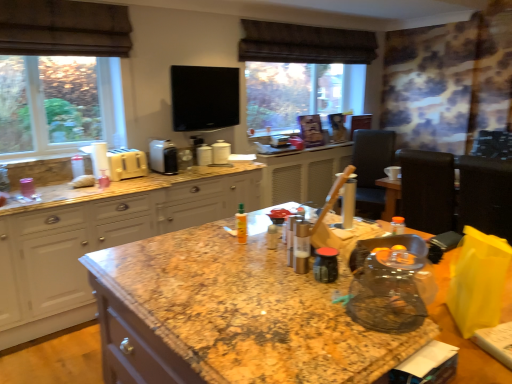
The image size is (512, 384). Describe the element at coordinates (83, 181) in the screenshot. I see `bread dough at left` at that location.

At what (x,y) coordinates should I click in order to perform the action: click on bread dough at left. Please return your answer as a coordinate pair (x, y). This screenshot has height=384, width=512. Looking at the image, I should click on (83, 181).

Measure the distance between point (109,152) and camera.

The depth of point (109,152) is 3.14 meters.

The width and height of the screenshot is (512, 384). Describe the element at coordinates (302, 174) in the screenshot. I see `granite countertop at center` at that location.

What do you see at coordinates (101, 241) in the screenshot? The height and width of the screenshot is (384, 512). I see `matte granite countertop at left` at bounding box center [101, 241].

The width and height of the screenshot is (512, 384). What do you see at coordinates (241, 224) in the screenshot?
I see `yellow matte bottle at center` at bounding box center [241, 224].

Measure the distance between point (435, 215) and camera.

Point (435, 215) and camera are 10.72 feet apart.

What are the coordinates of `bread dough at left` in the screenshot? It's located at (83, 181).

Is yellow plastic toaster at left, which is the 4th appliance in right-to-left order, to the left of white glossy canister at center, arranged as the 1th appliance when viewed from the right, from the viewer's perspective?

Indeed, yellow plastic toaster at left, which is the 4th appliance in right-to-left order, is positioned on the left side of white glossy canister at center, arranged as the 1th appliance when viewed from the right.

Is yellow plastic toaster at left, the first appliance viewed from the left, facing towards white glossy canister at center, arranged as the 1th appliance when viewed from the right?

No, yellow plastic toaster at left, the first appliance viewed from the left, is not oriented towards white glossy canister at center, arranged as the 1th appliance when viewed from the right.

Looking at their sizes, would you say yellow plastic toaster at left, which is the 4th appliance in right-to-left order, is wider or thinner than white glossy canister at center, marked as the 4th appliance in a left-to-right arrangement?

yellow plastic toaster at left, which is the 4th appliance in right-to-left order, is wider than white glossy canister at center, marked as the 4th appliance in a left-to-right arrangement.

Which is nearer, (x=77, y=179) or (x=220, y=272)?

Point (x=77, y=179) appears to be farther away from the viewer than point (x=220, y=272).

Are bread dough at left and granite at center far apart?

Indeed, bread dough at left is not near granite at center.

Does bread dough at left appear on the right side of granite at center?

In fact, bread dough at left is to the left of granite at center.

Does white glossy canisters at center, arranged as the 3th appliance when viewed from the left, have a smaller size compared to white plastic toaster at center, marked as the 2th appliance in a left-to-right arrangement?

Yes.

In the scene shown: Does white glossy canisters at center, arranged as the 3th appliance when viewed from the left, come behind white plastic toaster at center, which is the 3th appliance from right to left?

Yes, the depth of white glossy canisters at center, arranged as the 3th appliance when viewed from the left, is greater than that of white plastic toaster at center, which is the 3th appliance from right to left.

From a real-world perspective, is white glossy canisters at center, the second appliance from the right, under white plastic toaster at center, which is the 3th appliance from right to left?

Yes, from a real-world perspective, white glossy canisters at center, the second appliance from the right, is below white plastic toaster at center, which is the 3th appliance from right to left.

Find the location of a particular element. the 1st appliance above the white plastic toaster at center, which is the 3th appliance from right to left (from the image's perspective) is located at coordinates (204, 155).

Which object is more forward, matte granite countertop at left or granite countertop at center?

matte granite countertop at left is closer to the camera.

From the image's perspective, relative to granite countertop at center, is matte granite countertop at left above or below?

Based on their image positions, matte granite countertop at left is located beneath granite countertop at center.

Which of these two, matte granite countertop at left or granite countertop at center, is bigger?

matte granite countertop at left.

Measure the distance between matte granite countertop at left and granite countertop at center.

They are 4.32 feet apart.

Is bread dough at left looking in the opposite direction of dark brown leather chair at right, which is the 2th chair from front to back?

bread dough at left is not turned away from dark brown leather chair at right, which is the 2th chair from front to back.

Which chair is the 1st one when counting from the right side of the bread dough at left? Please provide its 2D coordinates.

[(371, 168)]

How different are the orientations of bread dough at left and dark brown leather chair at right, which is the 2th chair from front to back, in degrees?

The angular difference between bread dough at left and dark brown leather chair at right, which is the 2th chair from front to back, is 66.2 degrees.

Considering the points (90, 181) and (368, 176), which point is in front, point (90, 181) or point (368, 176)?

The point (90, 181) is more forward.

Which object is closer to the camera, dark brown leather chair at right, placed as the 1th chair when sorted from back to front, or white glossy canister at center, marked as the 4th appliance in a left-to-right arrangement?

white glossy canister at center, marked as the 4th appliance in a left-to-right arrangement, is more forward.

Is dark brown leather chair at right, which is the 2th chair from front to back, located outside white glossy canister at center, arranged as the 1th appliance when viewed from the right?

Yes, dark brown leather chair at right, which is the 2th chair from front to back, is located beyond the bounds of white glossy canister at center, arranged as the 1th appliance when viewed from the right.

There is a dark brown leather chair at right, which is the 2th chair from front to back. Where is `the 2nd appliance above it (from a real-world perspective)`? The height and width of the screenshot is (384, 512). the 2nd appliance above it (from a real-world perspective) is located at coordinates (221, 153).

Which is in front, point (244, 216) or point (151, 157)?

The point (244, 216) is closer.

Does yellow matte bottle at center have a lesser width compared to white plastic toaster at center, marked as the 2th appliance in a left-to-right arrangement?

Correct, the width of yellow matte bottle at center is less than that of white plastic toaster at center, marked as the 2th appliance in a left-to-right arrangement.

From the image's perspective, which is above, yellow matte bottle at center or white plastic toaster at center, which is the 3th appliance from right to left?

white plastic toaster at center, which is the 3th appliance from right to left, is shown above in the image.

Is yellow matte bottle at center not near white plastic toaster at center, which is the 3th appliance from right to left?

That's right, there is a large distance between yellow matte bottle at center and white plastic toaster at center, which is the 3th appliance from right to left.

From the image's perspective, starting from the white glossy canister at center, marked as the 4th appliance in a left-to-right arrangement, which appliance is the 3rd one below? Please provide its 2D coordinates.

[(127, 164)]

The image size is (512, 384). I want to click on countertop on the right of bread dough at left, so click(231, 316).

In the scene shown: Which object lies further to the anchor point white glossy canister at center, marked as the 4th appliance in a left-to-right arrangement, dark brown leather chair at right, placed as the 1th chair when sorted from back to front, or granite countertop at center?

Among the two, dark brown leather chair at right, placed as the 1th chair when sorted from back to front, is located further to white glossy canister at center, marked as the 4th appliance in a left-to-right arrangement.

Based on their spatial positions, is black leather chair at right, which appears as the first chair when viewed from the front, or dark brown leather chair at right, placed as the 1th chair when sorted from back to front, closer to white plastic toaster at center, marked as the 2th appliance in a left-to-right arrangement?

black leather chair at right, which appears as the first chair when viewed from the front, lies closer to white plastic toaster at center, marked as the 2th appliance in a left-to-right arrangement, than the other object.

Based on their spatial positions, is yellow matte bottle at center or white plastic toaster at center, which is the 3th appliance from right to left, further from white glossy canister at center, marked as the 4th appliance in a left-to-right arrangement?

yellow matte bottle at center is further to white glossy canister at center, marked as the 4th appliance in a left-to-right arrangement.

From the image, which object appears to be nearer to black leather chair at right, which is counted as the second chair, starting from the back, bread dough at left or white glossy canisters at center, arranged as the 3th appliance when viewed from the left?

Among the two, white glossy canisters at center, arranged as the 3th appliance when viewed from the left, is located nearer to black leather chair at right, which is counted as the second chair, starting from the back.

Estimate the real-world distances between objects in this image. Which object is further from yellow matte bottle at center, yellow plastic toaster at left, the first appliance viewed from the left, or white glossy canister at center, marked as the 4th appliance in a left-to-right arrangement?

The object further to yellow matte bottle at center is white glossy canister at center, marked as the 4th appliance in a left-to-right arrangement.

Estimate the real-world distances between objects in this image. Which object is further from bread dough at left, white glossy canisters at center, arranged as the 3th appliance when viewed from the left, or granite countertop at center?

Among the two, granite countertop at center is located further to bread dough at left.

Estimate the real-world distances between objects in this image. Which object is closer to granite countertop at center, granite at center or bread dough at left?

bread dough at left.

When comparing their distances from granite countertop at center, does black leather chair at right, which is counted as the second chair, starting from the back, or white plastic toaster at center, which is the 3th appliance from right to left, seem further?

The object further to granite countertop at center is white plastic toaster at center, which is the 3th appliance from right to left.

Where is `bottle located between granite at center and yellow plastic toaster at left, which is the 4th appliance in right-to-left order, in the depth direction`? bottle located between granite at center and yellow plastic toaster at left, which is the 4th appliance in right-to-left order, in the depth direction is located at coordinates (241, 224).

Find the location of a particular element. This screenshot has width=512, height=384. bottle between yellow plastic toaster at left, which is the 4th appliance in right-to-left order, and dark brown leather chair at right, which is the 2th chair from front to back, in the horizontal direction is located at coordinates (241, 224).

Identify the location of bottle between matte granite countertop at left and black leather chair at right, which is counted as the second chair, starting from the back, from left to right. (241, 224).

This screenshot has width=512, height=384. I want to click on counter between white glossy canister at center, arranged as the 1th appliance when viewed from the right, and black leather chair at right, which appears as the first chair when viewed from the front, from left to right, so click(x=302, y=174).